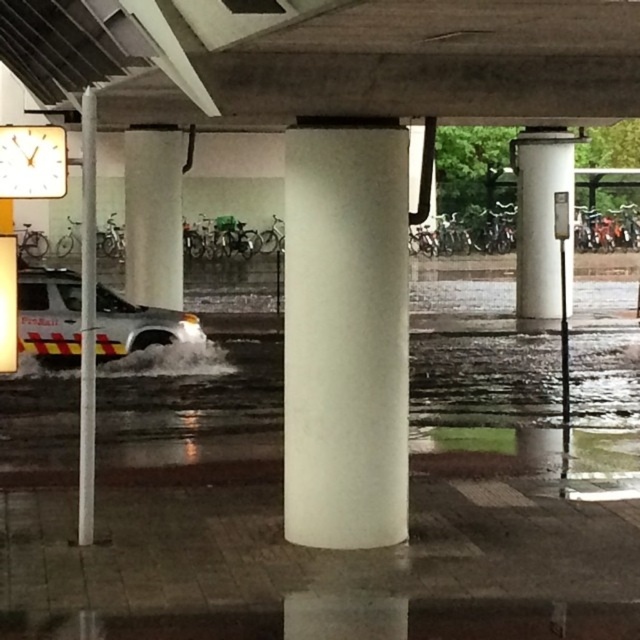
Question: Which point is closer to the camera taking this photo?

Choices:
 (A) (285, 300)
 (B) (20, 296)

Answer: (A)

Question: Is concrete at center bigger than white smooth column at center?

Choices:
 (A) yes
 (B) no

Answer: (A)

Question: Is white smooth column at center closer to camera compared to white glossy van at lower left?

Choices:
 (A) yes
 (B) no

Answer: (A)

Question: Which point appears farthest from the camera in this image?

Choices:
 (A) (435, 88)
 (B) (381, 220)
 (C) (68, 316)
 (D) (563, 148)

Answer: (D)

Question: Which point is farther from the camera taking this photo?

Choices:
 (A) (138, 102)
 (B) (541, 275)

Answer: (B)

Question: In this image, where is white smooth column at center located relative to smooth concrete pillar at center?

Choices:
 (A) right
 (B) left

Answer: (A)